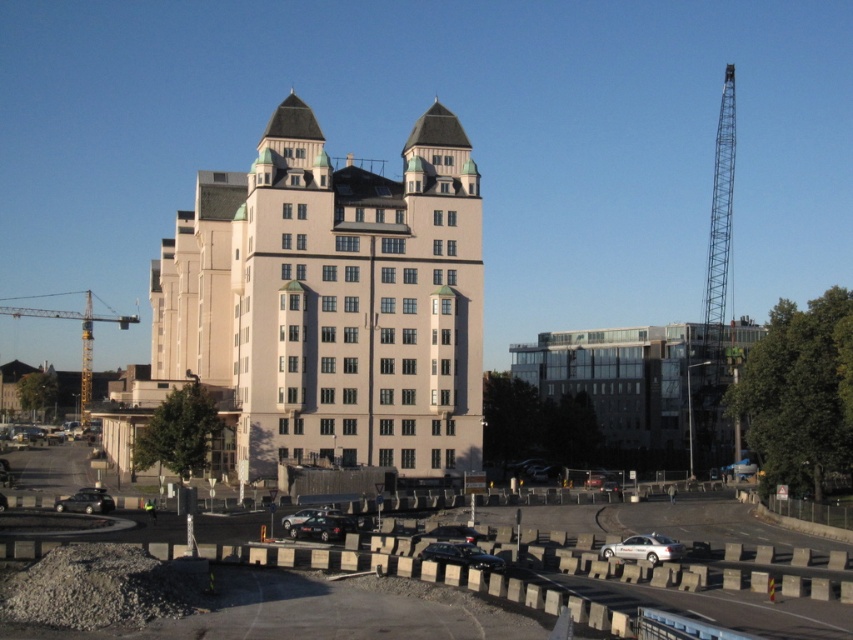
Is yellow metallic crane at left above shiny black car at lower center?

Yes.

Who is shorter, yellow metallic crane at left or shiny black car at lower center?

Standing shorter between the two is shiny black car at lower center.

Is point (86, 364) positioned after point (427, 548)?

Yes, point (86, 364) is behind point (427, 548).

This screenshot has width=853, height=640. I want to click on yellow metallic crane at left, so click(80, 339).

Is yellow metallic crane at left smaller than silver metallic car at lower center?

Incorrect, yellow metallic crane at left is not smaller in size than silver metallic car at lower center.

Who is more forward, (84,397) or (666,547)?

Point (666,547) is more forward.

Where is `yellow metallic crane at left`? Image resolution: width=853 pixels, height=640 pixels. yellow metallic crane at left is located at coordinates (80, 339).

The image size is (853, 640). I want to click on yellow metallic crane at left, so click(80, 339).

Which is more to the left, beige concrete building at center or glassy reflective building at center right?

beige concrete building at center is more to the left.

Which of these two, beige concrete building at center or glassy reflective building at center right, stands taller?

beige concrete building at center is taller.

The height and width of the screenshot is (640, 853). Describe the element at coordinates (334, 300) in the screenshot. I see `beige concrete building at center` at that location.

Find the location of a particular element. Image resolution: width=853 pixels, height=640 pixels. beige concrete building at center is located at coordinates (334, 300).